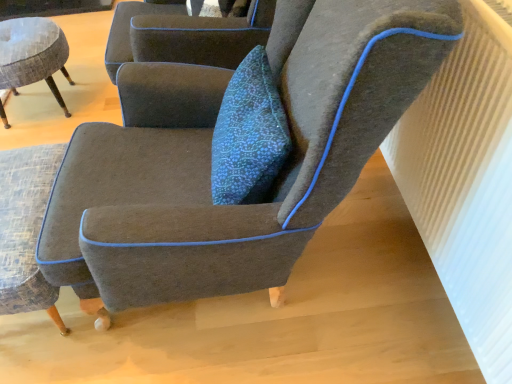
Question: From the image's perspective, does textured gray armchair at lower left, positioned as the second chair in left-to-right order, appear higher than dark gray fabric chair at center, the 3th chair when ordered from left to right?

Choices:
 (A) yes
 (B) no

Answer: (B)

Question: Can you confirm if textured gray armchair at lower left, the second chair when ordered from right to left, is smaller than dark gray fabric chair at center, the 3th chair when ordered from left to right?

Choices:
 (A) no
 (B) yes

Answer: (B)

Question: Is textured gray armchair at lower left, the second chair when ordered from right to left, outside of dark gray fabric chair at center, the 3th chair when ordered from left to right?

Choices:
 (A) yes
 (B) no

Answer: (A)

Question: Can you confirm if textured gray armchair at lower left, positioned as the second chair in left-to-right order, is shorter than dark gray fabric chair at center, which is the 1th chair in right-to-left order?

Choices:
 (A) yes
 (B) no

Answer: (A)

Question: Does textured gray armchair at lower left, positioned as the second chair in left-to-right order, contain dark gray fabric chair at center, the 3th chair when ordered from left to right?

Choices:
 (A) yes
 (B) no

Answer: (B)

Question: Is textured gray armchair at lower left, the second chair when ordered from right to left, facing towards dark gray fabric chair at center, the 3th chair when ordered from left to right?

Choices:
 (A) no
 (B) yes

Answer: (A)

Question: Does white ribbed radiator at upper right turn towards textured gray armchair at lower left, positioned as the second chair in left-to-right order?

Choices:
 (A) yes
 (B) no

Answer: (A)

Question: Can you confirm if white ribbed radiator at upper right is positioned to the right of textured gray armchair at lower left, positioned as the second chair in left-to-right order?

Choices:
 (A) no
 (B) yes

Answer: (B)

Question: Is white ribbed radiator at upper right with textured gray armchair at lower left, the second chair when ordered from right to left?

Choices:
 (A) no
 (B) yes

Answer: (A)

Question: Is white ribbed radiator at upper right looking in the opposite direction of textured gray armchair at lower left, positioned as the second chair in left-to-right order?

Choices:
 (A) yes
 (B) no

Answer: (B)

Question: Is white ribbed radiator at upper right far from textured gray armchair at lower left, the second chair when ordered from right to left?

Choices:
 (A) yes
 (B) no

Answer: (A)

Question: Is white ribbed radiator at upper right wider than textured gray armchair at lower left, positioned as the second chair in left-to-right order?

Choices:
 (A) yes
 (B) no

Answer: (B)

Question: Is textured gray stool at left, the 1th chair viewed from the left, shorter than white ribbed radiator at upper right?

Choices:
 (A) yes
 (B) no

Answer: (A)